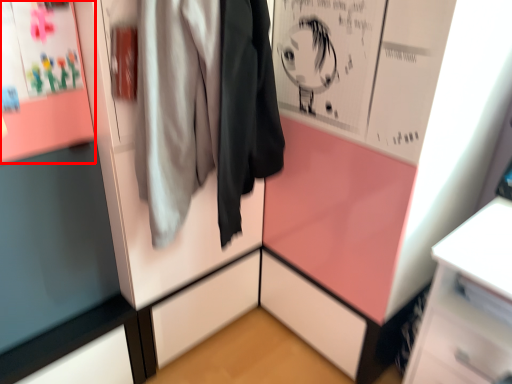
Question: From the image's perspective, considering the relative positions of poster page (annotated by the red box) and jacket in the image provided, where is poster page (annotated by the red box) located with respect to the staircase?

Choices:
 (A) below
 (B) above

Answer: (B)